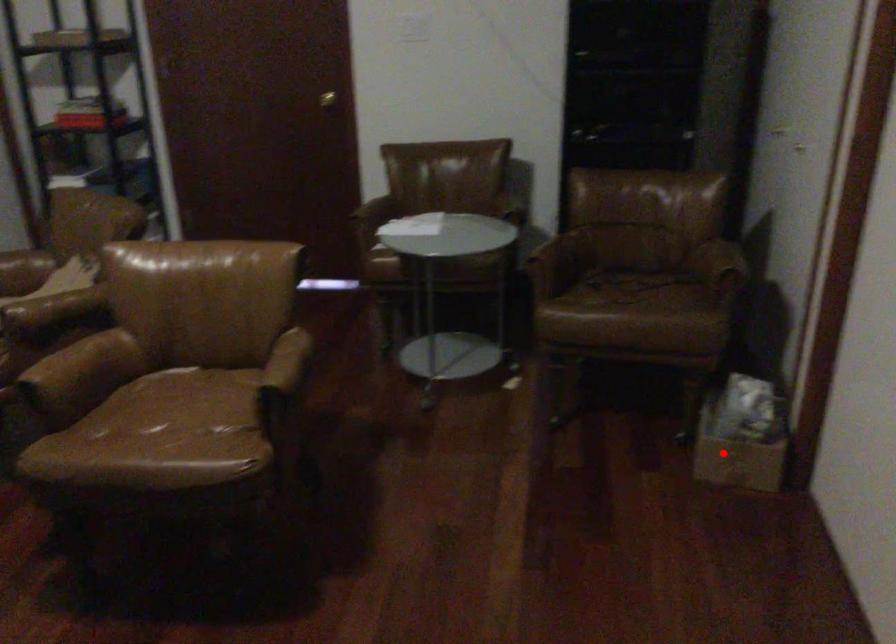
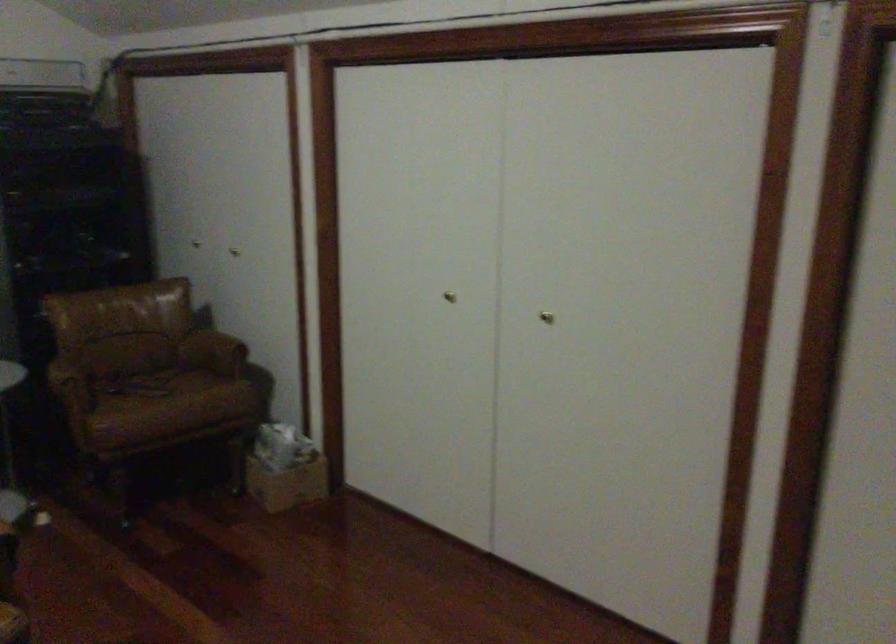
Locate, in the second image, the point that corresponds to the highlighted location in the first image.

(287, 484)